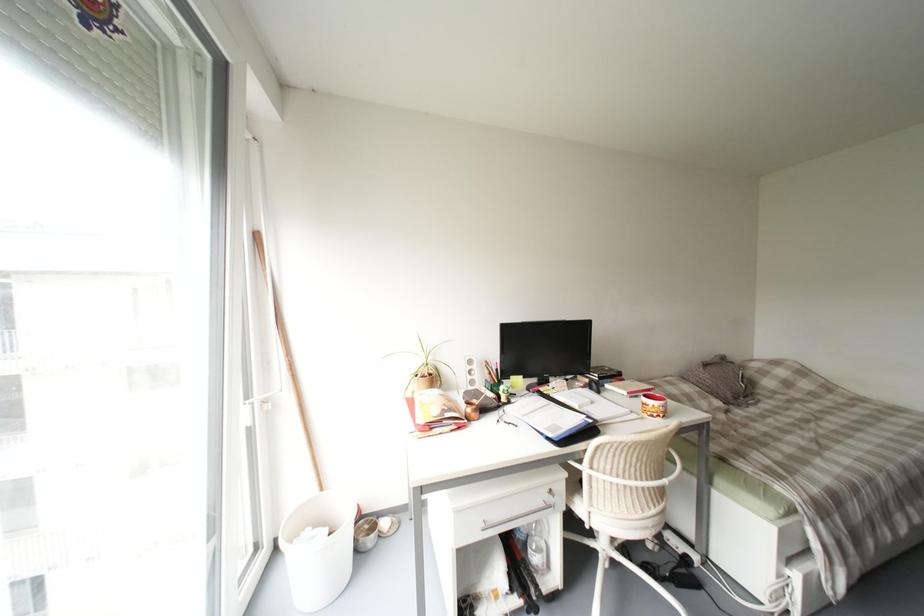
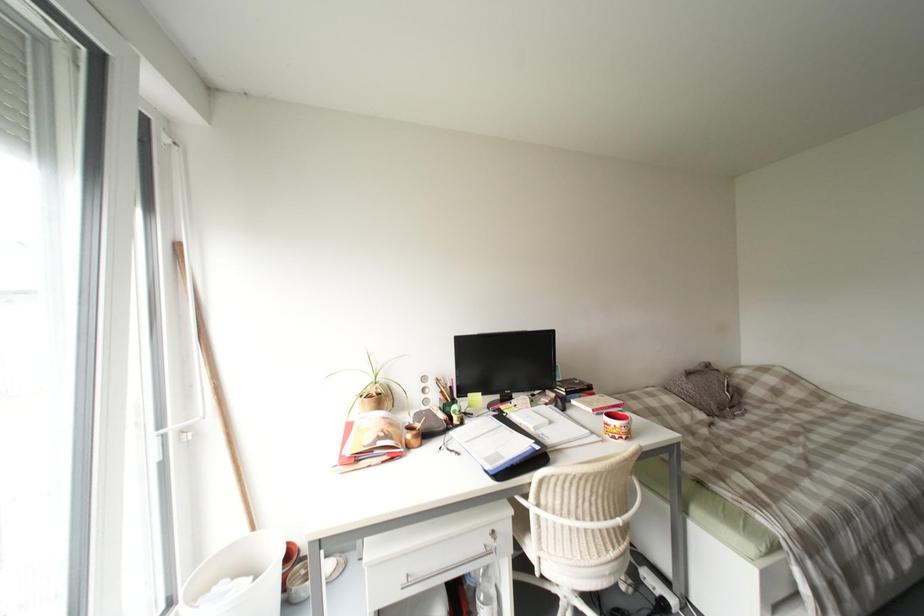
Question: The first image is from the beginning of the video and the second image is from the end. How did the camera likely rotate when shooting the video?

Choices:
 (A) Left
 (B) Right
 (C) Up
 (D) Down

Answer: (C)